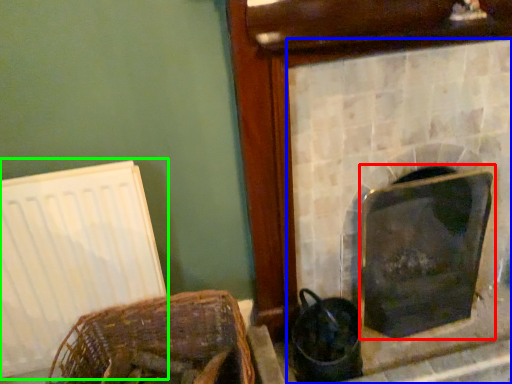
Question: Considering the real-world distances, which object is closest to fireplace (highlighted by a red box)? fireplace (highlighted by a blue box) or radiator (highlighted by a green box).

Choices:
 (A) fireplace
 (B) radiator

Answer: (A)